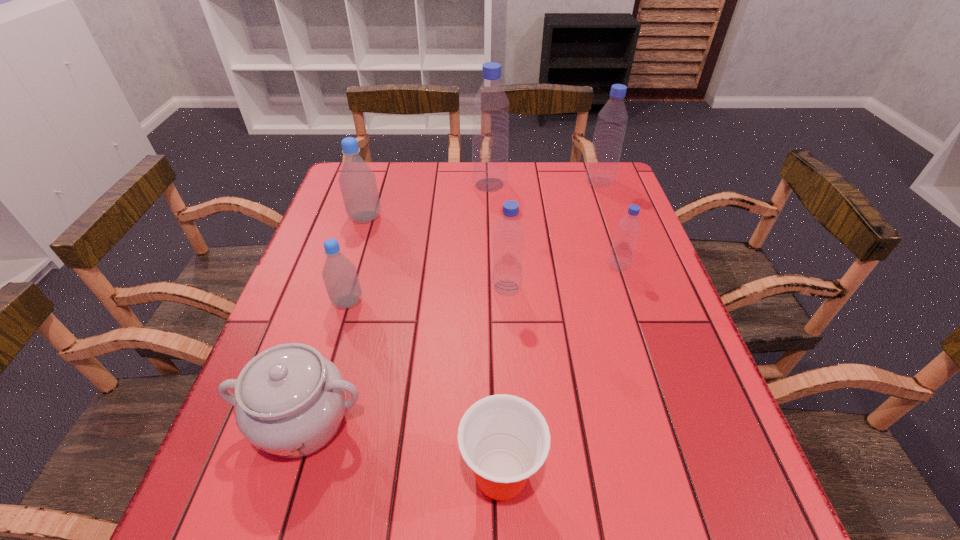
Image resolution: width=960 pixels, height=540 pixels. I want to click on the tallest bottle, so click(490, 136).

Identify the location of the biggest blue bottle. click(490, 136).

The image size is (960, 540). What are the coordinates of `the third smallest blue bottle` in the screenshot? It's located at (602, 167).

Find the location of a particular element. the second tallest object is located at coordinates (602, 167).

Where is `the second smallest blue bottle`? The width and height of the screenshot is (960, 540). the second smallest blue bottle is located at coordinates (509, 234).

You are a GUI agent. You are given a task and a screenshot of the screen. Output one action in this format:
    pyautogui.click(x=<x>, y=<y>)
    Task: Click on the fourth nearest bottle
    This screenshot has height=540, width=960.
    Given the screenshot: What is the action you would take?
    pyautogui.click(x=358, y=185)

The image size is (960, 540). I want to click on the bigger gray bottle, so click(x=358, y=185).

Where is `the smaller gray bottle`? The image size is (960, 540). the smaller gray bottle is located at coordinates (339, 274).

Find the location of a particular element. The width and height of the screenshot is (960, 540). the third farthest blue bottle is located at coordinates (624, 243).

Locate an element on the screen. The image size is (960, 540). the smallest blue bottle is located at coordinates (624, 243).